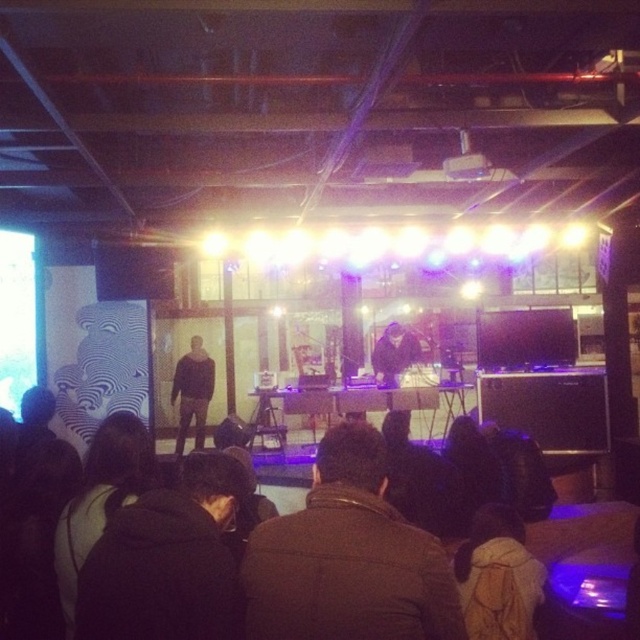
You are a photographer at the event and need to capture both the black fuzzy jacket at lower center and the dark fabric jacket at center in a single shot. Which jacket should you focus on first to ensure both are in frame?

The black fuzzy jacket at lower center has a lesser height compared to dark fabric jacket at center, so you should focus on the dark fabric jacket at center first to ensure both are in frame.

You are a stagehand preparing to move equipment. You need to retrieve the dark fabric jacket at lower left and the brown backpack at lower right. Which item is closer to the ceiling beams?

The dark fabric jacket at lower left is above the brown backpack at lower right, so it is closer to the ceiling beams.